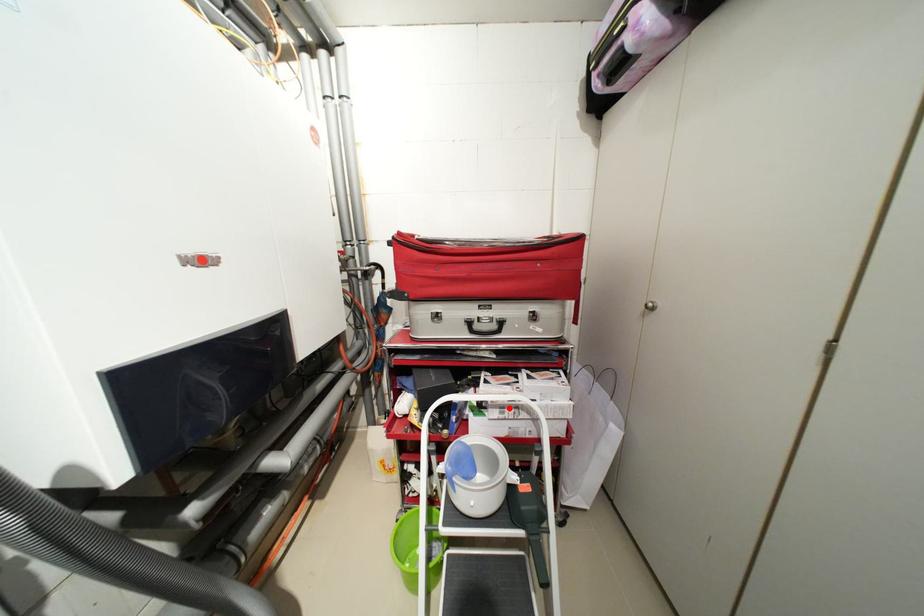
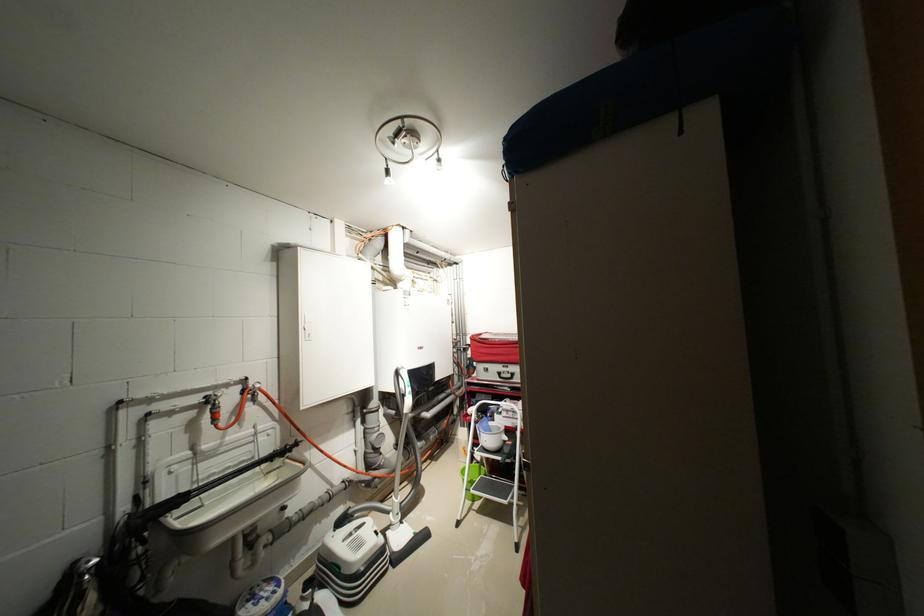
Question: I am providing you with two images of the same scene from different viewpoints. A red point is shown in image1. For the corresponding object point in image2, is it positioned nearer or farther from the camera?

Choices:
 (A) Nearer
 (B) Farther

Answer: (B)